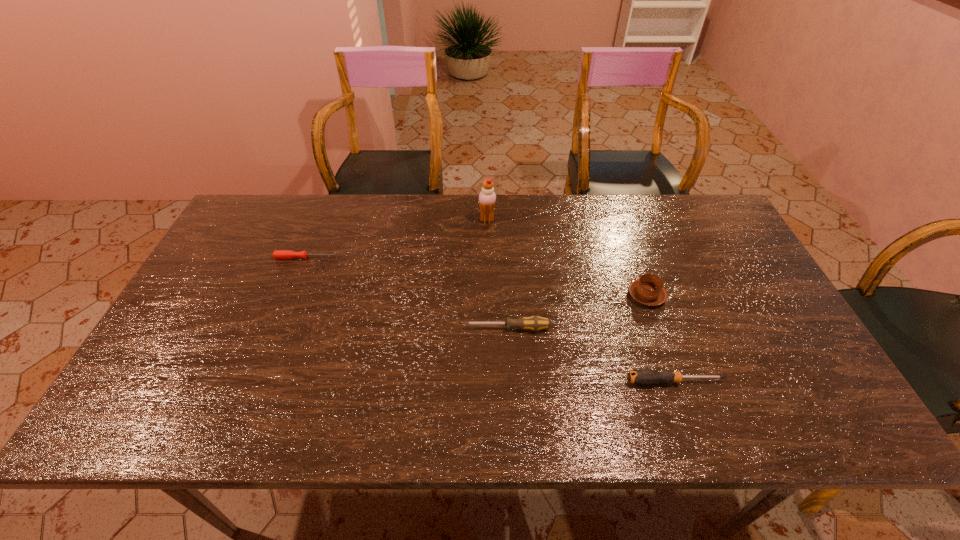
Locate an element on the screen. Image resolution: width=960 pixels, height=540 pixels. free space located 0.240m at the front with a straw on the farthest object is located at coordinates (405, 220).

The height and width of the screenshot is (540, 960). In order to click on vacant space situated at the front with a straw on the farthest object in this screenshot , I will do `click(405, 220)`.

The width and height of the screenshot is (960, 540). Identify the location of vacant space positioned at the front with a straw on the farthest object. (398, 220).

Identify the location of blank space located 0.170m on the side of the cappuccino with the handle. (628, 241).

I want to click on free space located 0.290m on the side of the cappuccino with the handle, so click(x=619, y=217).

Image resolution: width=960 pixels, height=540 pixels. Identify the location of blank space located on the side of the cappuccino with the handle. (612, 197).

Locate an element on the screen. The height and width of the screenshot is (540, 960). vacant space situated 0.110m at the tip of the fourth farthest object is located at coordinates (421, 328).

Locate an element on the screen. This screenshot has height=540, width=960. free space located 0.140m at the tip of the fourth farthest object is located at coordinates (410, 328).

This screenshot has height=540, width=960. I want to click on blank area located at the tip of the fourth farthest object, so click(x=328, y=328).

Identify the location of free region located 0.310m on the back of the rightmost screwdriver. Image resolution: width=960 pixels, height=540 pixels. (639, 279).